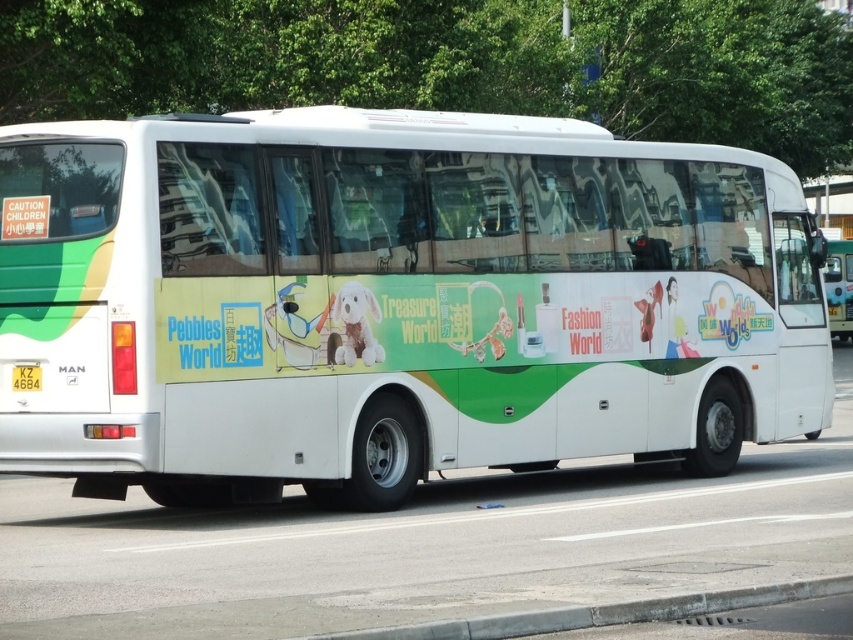
Question: Can you confirm if white glossy bus at right is positioned below yellow plastic license plate at rear?

Choices:
 (A) yes
 (B) no

Answer: (B)

Question: Does white glossy bus at center appear over white glossy bus at right?

Choices:
 (A) no
 (B) yes

Answer: (A)

Question: Among these points, which one is nearest to the camera?

Choices:
 (A) (846, 260)
 (B) (38, 388)

Answer: (B)

Question: Is white glossy bus at center bigger than yellow plastic license plate at rear?

Choices:
 (A) no
 (B) yes

Answer: (B)

Question: Which point appears farthest from the camera in this image?

Choices:
 (A) (24, 364)
 (B) (845, 275)
 (C) (318, 484)

Answer: (B)

Question: Which of the following is the farthest from the observer?

Choices:
 (A) (796, 312)
 (B) (33, 380)

Answer: (A)